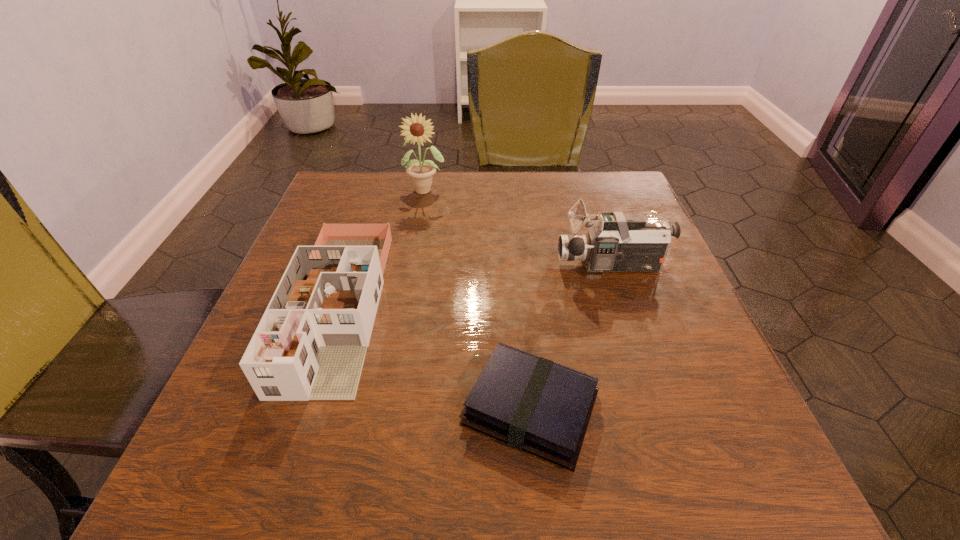
Locate an element on the screen. Image resolution: width=960 pixels, height=540 pixels. vacant position located on the left of the shortest object is located at coordinates (394, 408).

The height and width of the screenshot is (540, 960). Find the location of `object present at the far edge`. object present at the far edge is located at coordinates (421, 173).

At what (x,y) coordinates should I click in order to perform the action: click on object that is at the near edge. Please return your answer as a coordinate pair (x, y). The width and height of the screenshot is (960, 540). Looking at the image, I should click on (533, 404).

The image size is (960, 540). Identify the location of object that is positioned at the left edge. (311, 342).

This screenshot has height=540, width=960. I want to click on object situated at the right edge, so click(x=618, y=242).

I want to click on vacant space at the far edge, so click(x=395, y=187).

At what (x,y) coordinates should I click in order to perform the action: click on free space at the near edge of the desktop. Please return your answer as a coordinate pair (x, y). This screenshot has height=540, width=960. Looking at the image, I should click on (429, 485).

This screenshot has width=960, height=540. I want to click on vacant area at the left edge, so click(306, 229).

You are a GUI agent. You are given a task and a screenshot of the screen. Output one action in this format:
    pyautogui.click(x=<x>, y=<y>)
    Task: Click on the free location at the right edge
    The height and width of the screenshot is (540, 960).
    Given the screenshot: What is the action you would take?
    pyautogui.click(x=661, y=340)

Where is `vacant region at the far left corner of the desktop`? vacant region at the far left corner of the desktop is located at coordinates (348, 200).